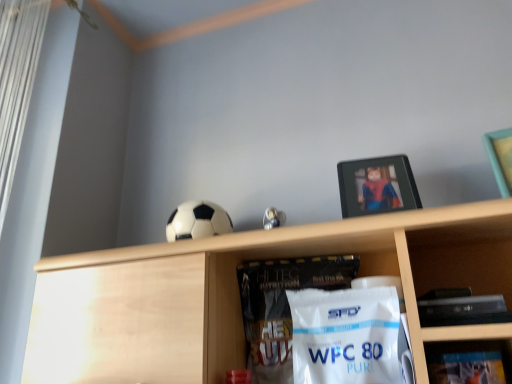
Question: Is metallic silver picture frame at upper center next to black matte soccer ball at upper center and touching it?

Choices:
 (A) no
 (B) yes

Answer: (A)

Question: Is black matte soccer ball at upper center surrounded by metallic silver picture frame at upper center?

Choices:
 (A) yes
 (B) no

Answer: (B)

Question: Is metallic silver picture frame at upper center to the left of black matte soccer ball at upper center from the viewer's perspective?

Choices:
 (A) no
 (B) yes

Answer: (A)

Question: Is metallic silver picture frame at upper center in front of black matte soccer ball at upper center?

Choices:
 (A) yes
 (B) no

Answer: (A)

Question: Can you confirm if metallic silver picture frame at upper center is wider than black matte soccer ball at upper center?

Choices:
 (A) no
 (B) yes

Answer: (A)

Question: From the image's perspective, relative to metallic silver picture frame at upper center, is metallic silver frame at upper right, which ranks as the 1th shelf in right-to-left order, above or below?

Choices:
 (A) below
 (B) above

Answer: (A)

Question: Considering the relative positions of metallic silver frame at upper right, which is the 1th shelf from back to front, and metallic silver picture frame at upper center in the image provided, is metallic silver frame at upper right, which is the 1th shelf from back to front, to the left or to the right of metallic silver picture frame at upper center?

Choices:
 (A) right
 (B) left

Answer: (A)

Question: Is metallic silver frame at upper right, acting as the second shelf starting from the left, in front of or behind metallic silver picture frame at upper center in the image?

Choices:
 (A) front
 (B) behind

Answer: (A)

Question: Is point (471, 345) positioned closer to the camera than point (374, 162)?

Choices:
 (A) closer
 (B) farther

Answer: (A)

Question: From the image's perspective, is black matte soccer ball at upper center above or below metallic silver frame at upper right, positioned as the second shelf in front-to-back order?

Choices:
 (A) above
 (B) below

Answer: (A)

Question: Is black matte soccer ball at upper center taller or shorter than metallic silver frame at upper right, acting as the second shelf starting from the left?

Choices:
 (A) short
 (B) tall

Answer: (B)

Question: From a real-world perspective, is black matte soccer ball at upper center physically located above or below metallic silver frame at upper right, which is the 1th shelf from back to front?

Choices:
 (A) above
 (B) below

Answer: (A)

Question: Based on their sizes in the image, would you say black matte soccer ball at upper center is bigger or smaller than metallic silver frame at upper right, which ranks as the 1th shelf in right-to-left order?

Choices:
 (A) small
 (B) big

Answer: (B)

Question: Considering the positions of metallic silver frame at upper right, which ranks as the 1th shelf in right-to-left order, and black matte soccer ball at upper center in the image, is metallic silver frame at upper right, which ranks as the 1th shelf in right-to-left order, wider or thinner than black matte soccer ball at upper center?

Choices:
 (A) thin
 (B) wide

Answer: (A)

Question: Visually, is metallic silver frame at upper right, positioned as the second shelf in front-to-back order, positioned to the left or to the right of black matte soccer ball at upper center?

Choices:
 (A) right
 (B) left

Answer: (A)